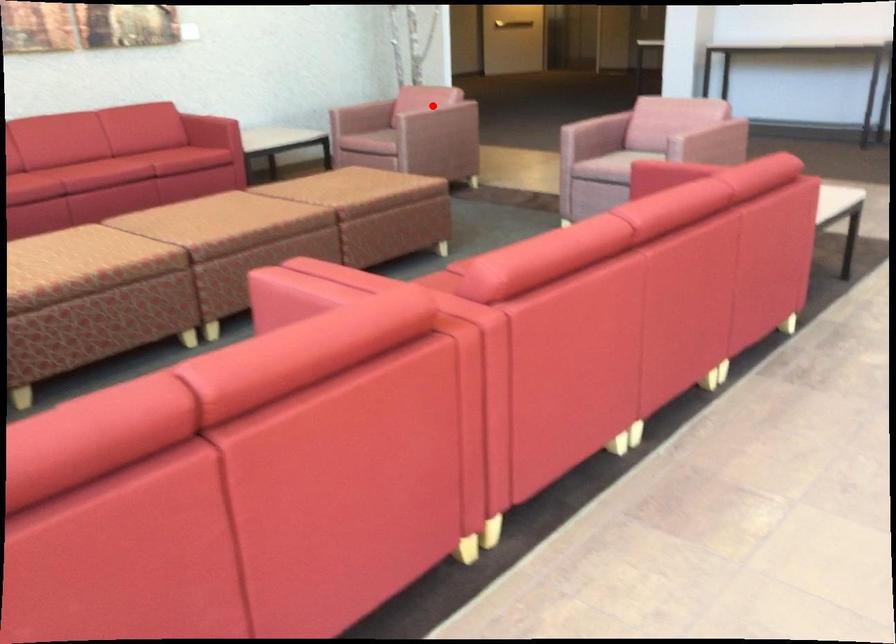
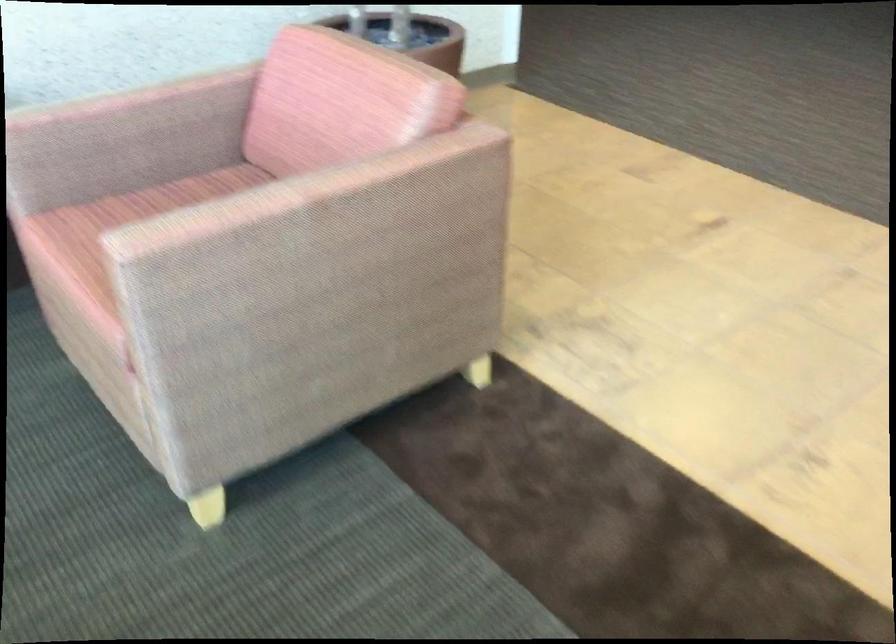
Question: I am providing you with two images of the same scene from different viewpoints. A red point is marked on the first image. At the location where the point appears in image 1, is it still visible in image 2?

Choices:
 (A) Yes
 (B) No

Answer: (A)